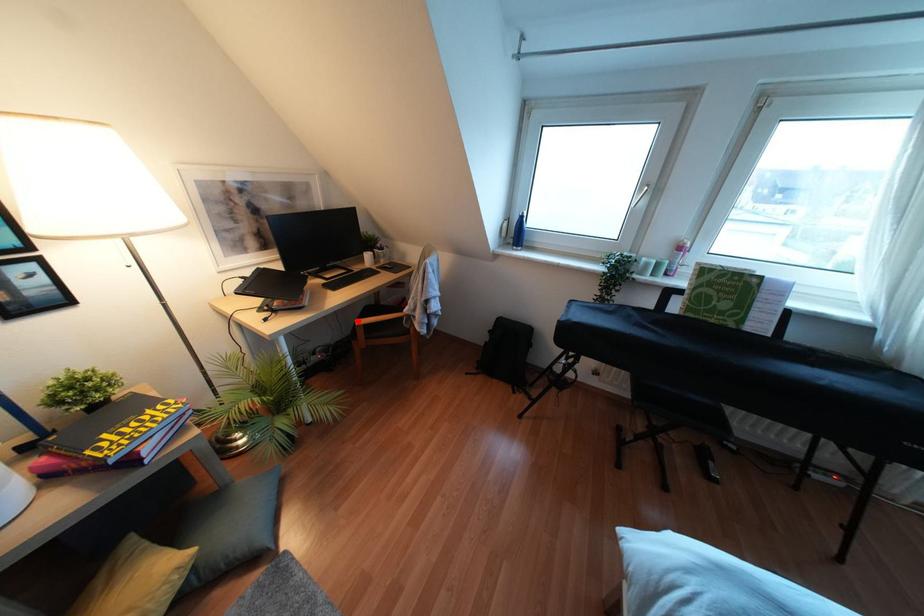
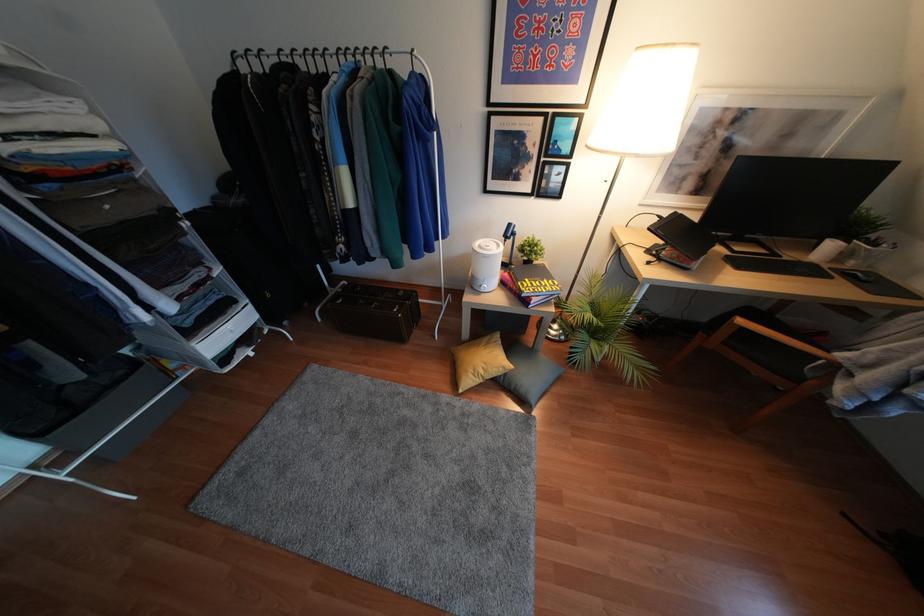
Question: I am providing you with two images of the same scene from different viewpoints. Image1 has a red point marked. In image2, the corresponding 3D location appears at what relative position? Reply with the corresponding letter.

Choices:
 (A) Closer
 (B) Farther

Answer: (B)